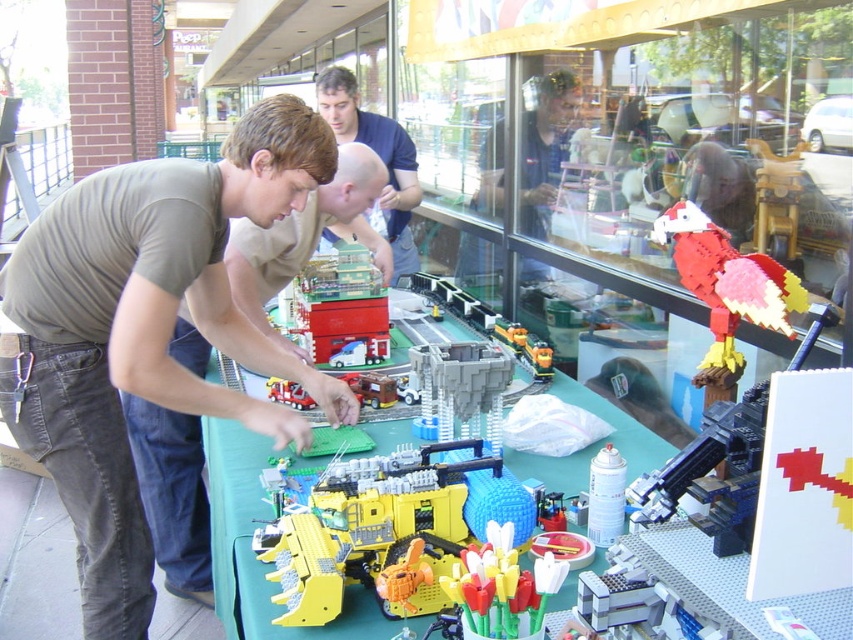
Question: Which point appears farthest from the camera in this image?

Choices:
 (A) (691, 250)
 (B) (409, 170)
 (C) (144, 435)
 (D) (540, 584)

Answer: (B)

Question: Is yellow plastic construction vehicle at center to the left of matte blue shirt at center from the viewer's perspective?

Choices:
 (A) no
 (B) yes

Answer: (B)

Question: Does yellow plastic construction vehicle at center have a larger size compared to matte brown shirt at center?

Choices:
 (A) yes
 (B) no

Answer: (B)

Question: Can you confirm if matte brown shirt at center is smaller than brick red plastic building at center?

Choices:
 (A) no
 (B) yes

Answer: (A)

Question: Which is nearer to the blue shirt at upper center?

Choices:
 (A) yellow plastic construction vehicle at center
 (B) brick-like train at center
 (C) matte blue shirt at center

Answer: (C)

Question: Which object appears farthest from the camera in this image?

Choices:
 (A) brick red plastic building at center
 (B) red plastic fire truck at center
 (C) brick-like parrot at upper right

Answer: (A)